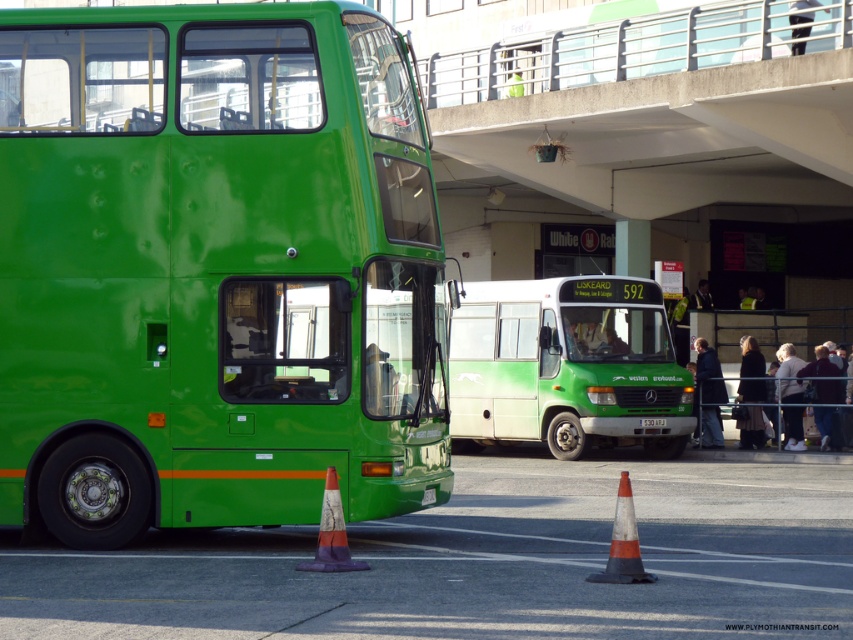
Question: In this image, where is green matte bus at center located relative to orange and white striped traffic cone at lower center?

Choices:
 (A) right
 (B) left

Answer: (A)

Question: Is green matte bus at left thinner than green matte bus at center?

Choices:
 (A) no
 (B) yes

Answer: (B)

Question: Which object is closer to the camera taking this photo?

Choices:
 (A) orange and white striped cone at lower center
 (B) green plastic license plate at center
 (C) green matte bus at center

Answer: (A)

Question: Which object is positioned farthest from the green plastic license plate at center?

Choices:
 (A) orange and white striped traffic cone at lower center
 (B) green matte bus at center

Answer: (A)

Question: Which object appears farthest from the camera in this image?

Choices:
 (A) green matte bus at center
 (B) orange and white striped traffic cone at lower center

Answer: (A)

Question: Observing the image, what is the correct spatial positioning of green matte bus at center in reference to green plastic license plate at center?

Choices:
 (A) below
 (B) above

Answer: (B)